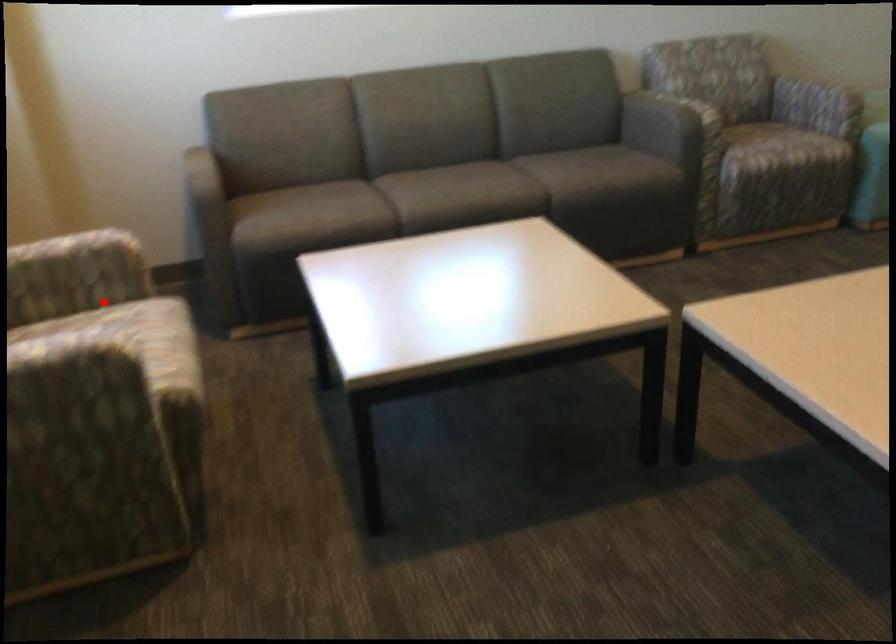
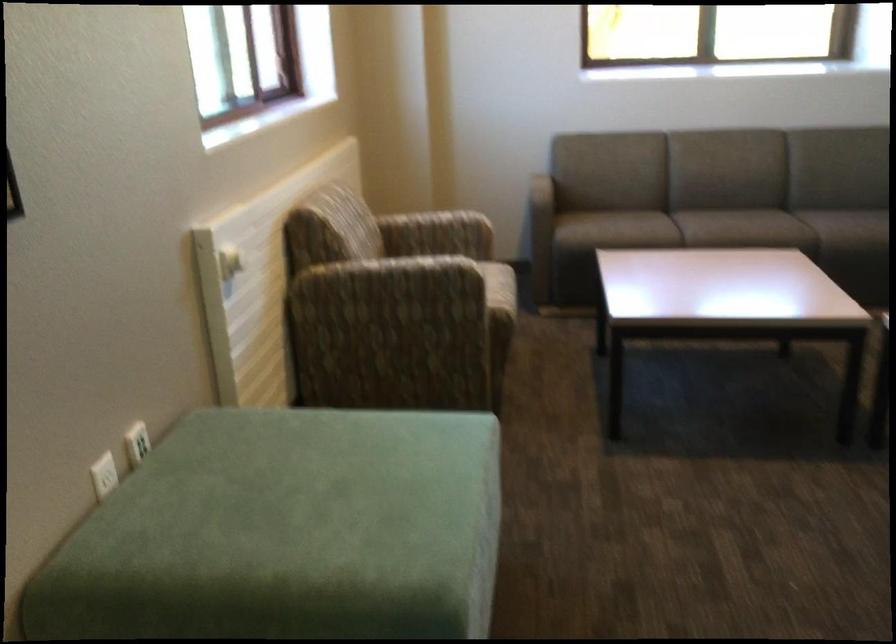
Find the pixel in the second image that matches the highlighted location in the first image.

(458, 254)